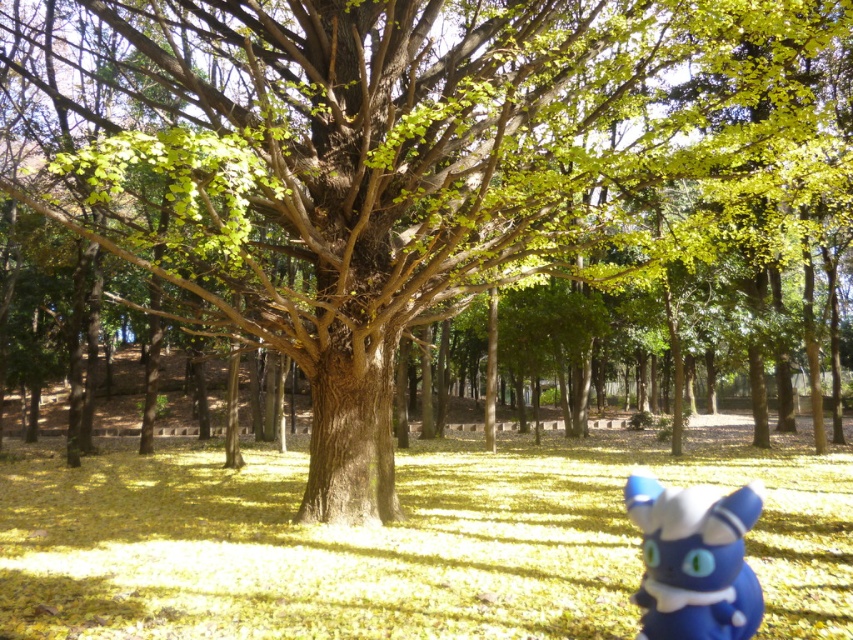
Question: Which point is farther from the camera taking this photo?

Choices:
 (A) (178, 538)
 (B) (730, 573)

Answer: (A)

Question: Does yellow matte grass at center appear under blue matte plush toy at lower right?

Choices:
 (A) yes
 (B) no

Answer: (A)

Question: Is yellow matte grass at center positioned behind blue matte plush toy at lower right?

Choices:
 (A) no
 (B) yes

Answer: (B)

Question: Which object appears closest to the camera in this image?

Choices:
 (A) yellow matte grass at center
 (B) blue matte plush toy at lower right

Answer: (B)

Question: Can you confirm if yellow matte grass at center is bigger than blue matte plush toy at lower right?

Choices:
 (A) yes
 (B) no

Answer: (A)